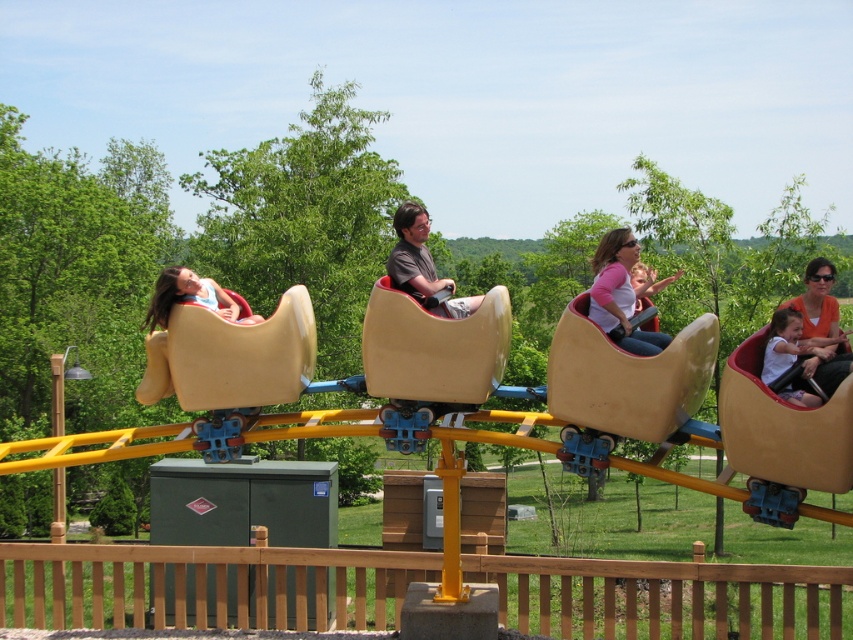
You are a photographer positioned at the entrance of the theme park. You want to take a photo of the orange cotton shirt at center without the matte yellow slide at left blocking it. What should you do?

The orange cotton shirt at center is behind the matte yellow slide at left, so to avoid the slide blocking the shirt, you should move to a position where you can see the shirt in front of the slide. Alternatively, you could adjust your angle to frame the shirt around the slide.

You are standing at the entrance of the theme park and see the wooden fence at lower center and the pink matte shirt at center. Which object is closer to your left side?

The wooden fence at lower center is to the left of the pink matte shirt at center, so it is closer to your left side.